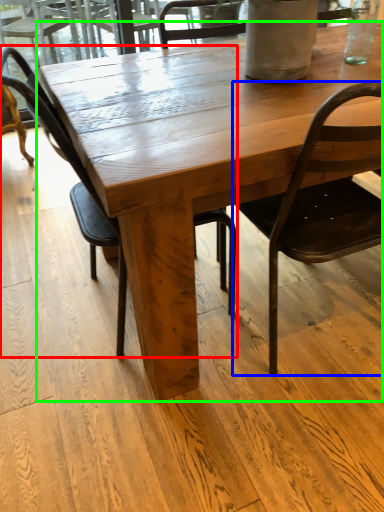
Question: Considering the real-world distances, which object is farthest from chair (highlighted by a red box)? chair (highlighted by a blue box) or coffee table (highlighted by a green box)?

Choices:
 (A) chair
 (B) coffee table

Answer: (A)